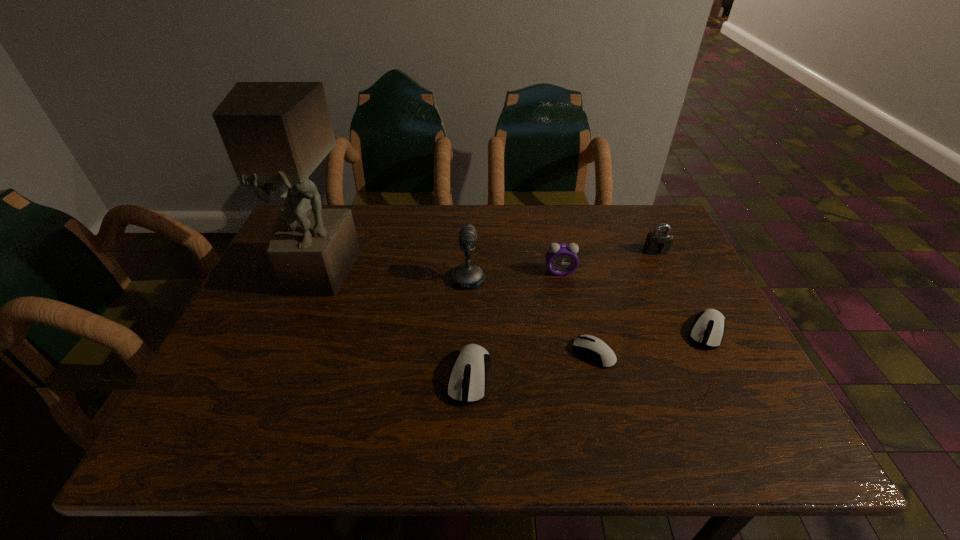
This screenshot has width=960, height=540. In order to click on vacant space at the far right corner of the desktop in this screenshot , I will do [650, 211].

The width and height of the screenshot is (960, 540). In the image, there is a desktop. Find the location of `vacant space at the near right corner`. vacant space at the near right corner is located at coordinates (706, 397).

Where is `empty space between the sixth tallest object and the alarm clock`? The height and width of the screenshot is (540, 960). empty space between the sixth tallest object and the alarm clock is located at coordinates (634, 301).

The width and height of the screenshot is (960, 540). Identify the location of free space between the shortest object and the tallest mouse. (532, 364).

Identify the location of free space that is in between the leftmost object and the second shortest object. (513, 302).

Identify the location of free space between the second mouse from left to right and the sixth shortest object. Image resolution: width=960 pixels, height=540 pixels. (531, 316).

Image resolution: width=960 pixels, height=540 pixels. I want to click on vacant area that lies between the second tallest object and the leftmost object, so click(x=394, y=276).

At what (x,y) coordinates should I click in order to perform the action: click on free space between the second mouse from left to right and the alarm clock. Please return your answer as a coordinate pair (x, y). Looking at the image, I should click on (577, 312).

Find the location of a particular element. The image size is (960, 540). free area in between the fifth tallest object and the padlock is located at coordinates pos(563,314).

Identify the location of free space between the padlock and the shortest mouse. (625, 302).